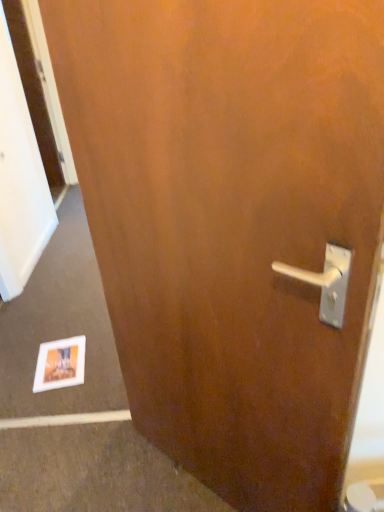
Question: From the image's perspective, is matte paper postcard at lower left positioned above or below wooden screen door at left?

Choices:
 (A) above
 (B) below

Answer: (B)

Question: From a real-world perspective, relative to wooden screen door at left, is matte paper postcard at lower left vertically above or below?

Choices:
 (A) above
 (B) below

Answer: (B)

Question: Considering the positions of point (54, 344) and point (3, 76), is point (54, 344) closer or farther from the camera than point (3, 76)?

Choices:
 (A) closer
 (B) farther

Answer: (A)

Question: From the image's perspective, is wooden screen door at left positioned above or below matte paper postcard at lower left?

Choices:
 (A) below
 (B) above

Answer: (B)

Question: From a real-world perspective, is wooden screen door at left above or below matte paper postcard at lower left?

Choices:
 (A) above
 (B) below

Answer: (A)

Question: Considering the relative positions of wooden screen door at left and matte paper postcard at lower left in the image provided, is wooden screen door at left to the left or to the right of matte paper postcard at lower left?

Choices:
 (A) right
 (B) left

Answer: (B)

Question: Is wooden screen door at left inside or outside of matte paper postcard at lower left?

Choices:
 (A) inside
 (B) outside

Answer: (B)